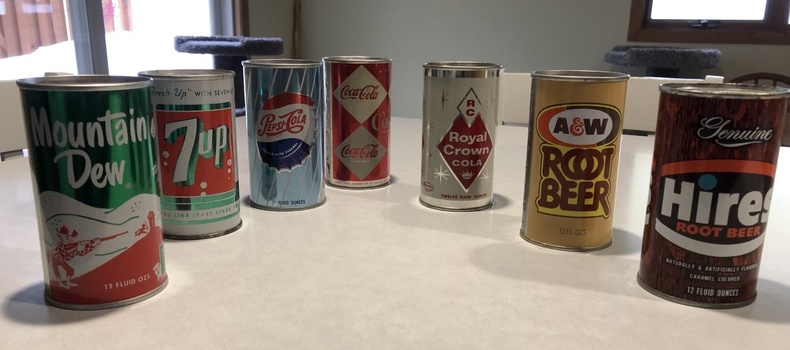
The image size is (790, 350). Find the location of `right pane window glass`. right pane window glass is located at coordinates (160, 45).